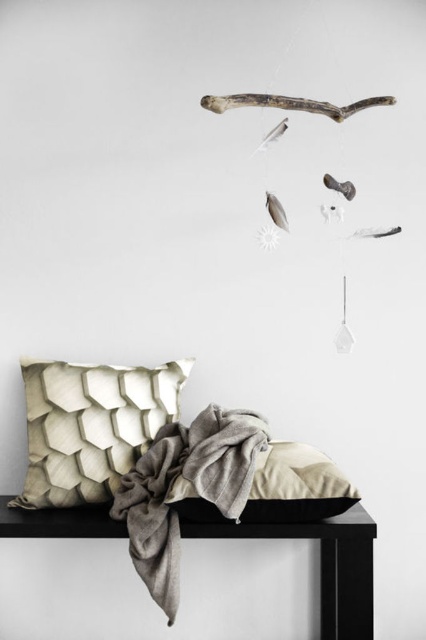
Question: Considering the real-world distances, which object is farthest from the black matte table at center?

Choices:
 (A) soft beige blanket at center
 (B) beige textured pillow at lower left

Answer: (B)

Question: Can you confirm if soft beige blanket at center is wider than black matte table at center?

Choices:
 (A) no
 (B) yes

Answer: (A)

Question: Observing the image, what is the correct spatial positioning of soft beige blanket at center in reference to black matte table at center?

Choices:
 (A) below
 (B) above

Answer: (B)

Question: Is beige textured pillow at lower left above black matte table at center?

Choices:
 (A) no
 (B) yes

Answer: (B)

Question: Estimate the real-world distances between objects in this image. Which object is closer to the soft beige blanket at center?

Choices:
 (A) beige textured pillow at lower left
 (B) black matte table at center

Answer: (B)

Question: Among these objects, which one is farthest from the camera?

Choices:
 (A) soft beige blanket at center
 (B) black matte table at center

Answer: (B)